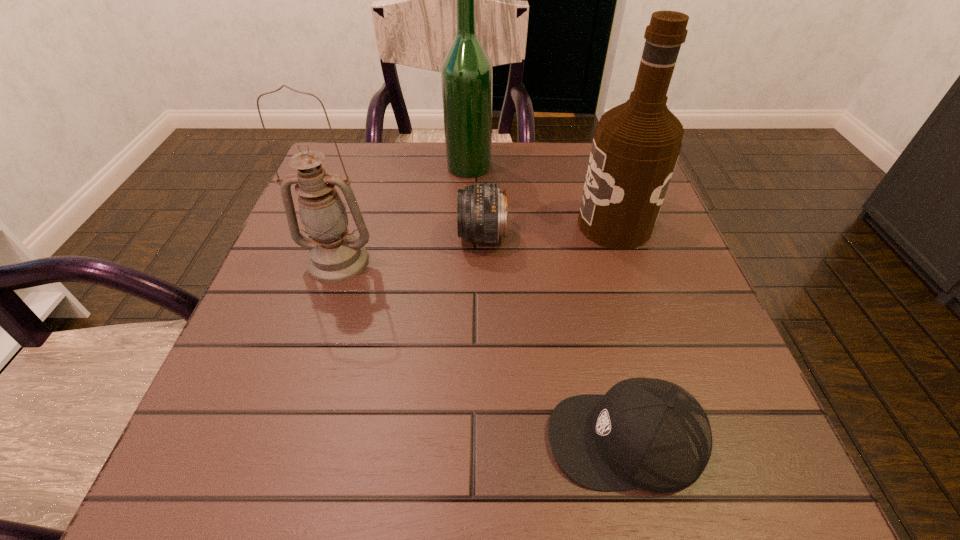
What are the coordinates of `vacant space at the near left corner of the desktop` in the screenshot? It's located at (196, 453).

In the image, there is a desktop. Identify the location of vacant space at the far right corner. (572, 144).

The height and width of the screenshot is (540, 960). In order to click on free space between the telephoto lens and the leftmost object in this screenshot , I will do `click(410, 249)`.

At what (x,y) coordinates should I click in order to perform the action: click on free space between the farther alcohol and the nearer alcohol. Please return your answer as a coordinate pair (x, y). Image resolution: width=960 pixels, height=540 pixels. Looking at the image, I should click on (541, 195).

Find the location of a particular element. free space between the telephoto lens and the cap is located at coordinates (554, 338).

Find the location of `vacant space that is in between the left alcohol and the leftmost object`. vacant space that is in between the left alcohol and the leftmost object is located at coordinates (403, 213).

This screenshot has height=540, width=960. Identify the location of free space between the fourth tallest object and the leftmost object. (410, 249).

I want to click on free space between the leftmost object and the right alcohol, so click(476, 243).

This screenshot has width=960, height=540. I want to click on free spot between the fourth tallest object and the cap, so click(554, 338).

Find the location of `free space that is in between the leftmost object and the nearer alcohol`. free space that is in between the leftmost object and the nearer alcohol is located at coordinates (476, 243).